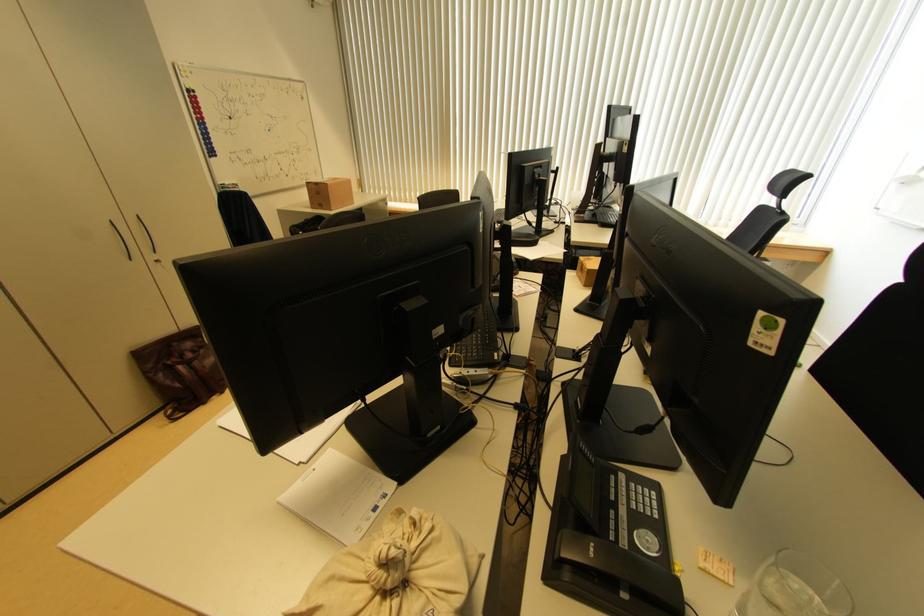
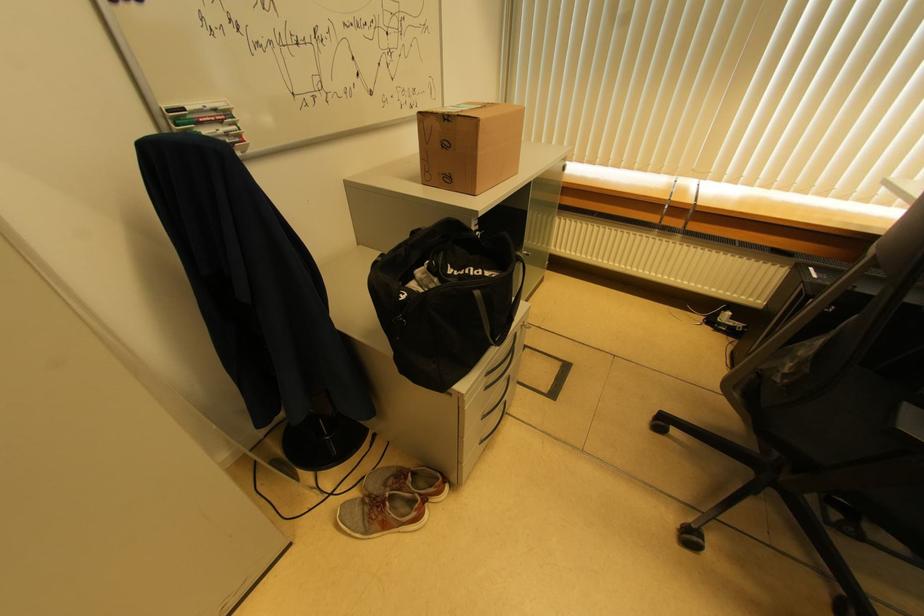
Which direction would the cameraman need to move to produce the second image?

The cameraman moved toward left, forward.